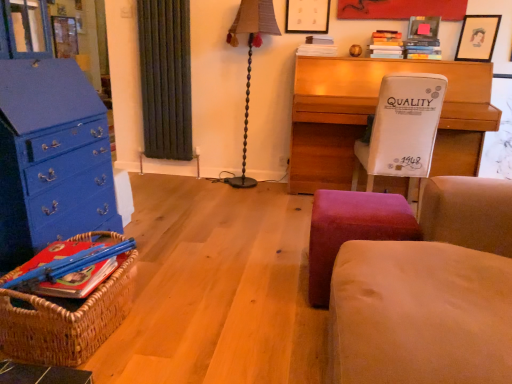
Question: Considering the relative positions of matte black picture frame at upper right, arranged as the second picture frame when viewed from the right, and matte black picture frame at upper right, the first picture frame positioned from the right, in the image provided, is matte black picture frame at upper right, arranged as the second picture frame when viewed from the right, to the right of matte black picture frame at upper right, the first picture frame positioned from the right, from the viewer's perspective?

Choices:
 (A) no
 (B) yes

Answer: (A)

Question: Would you say matte black picture frame at upper right, acting as the 2th picture frame starting from the left, is outside matte black picture frame at upper right, the third picture frame in the left-to-right sequence?

Choices:
 (A) yes
 (B) no

Answer: (A)

Question: Is the depth of matte black picture frame at upper right, arranged as the second picture frame when viewed from the right, less than that of matte black picture frame at upper right, the first picture frame positioned from the right?

Choices:
 (A) yes
 (B) no

Answer: (B)

Question: Is matte black picture frame at upper right, the first picture frame positioned from the right, located within matte black picture frame at upper right, acting as the 2th picture frame starting from the left?

Choices:
 (A) yes
 (B) no

Answer: (B)

Question: Is matte black picture frame at upper right, arranged as the second picture frame when viewed from the right, shorter than matte black picture frame at upper right, the third picture frame in the left-to-right sequence?

Choices:
 (A) yes
 (B) no

Answer: (A)

Question: Is matte black picture frame at upper right, arranged as the second picture frame when viewed from the right, looking in the opposite direction of matte black picture frame at upper right, the first picture frame positioned from the right?

Choices:
 (A) yes
 (B) no

Answer: (B)

Question: Does beige fabric rocking chair at right have a greater height compared to brown fabric lampshade at center?

Choices:
 (A) yes
 (B) no

Answer: (B)

Question: Can you see beige fabric rocking chair at right touching brown fabric lampshade at center?

Choices:
 (A) yes
 (B) no

Answer: (B)

Question: From the image's perspective, does beige fabric rocking chair at right appear higher than brown fabric lampshade at center?

Choices:
 (A) no
 (B) yes

Answer: (A)

Question: From a real-world perspective, is beige fabric rocking chair at right under brown fabric lampshade at center?

Choices:
 (A) yes
 (B) no

Answer: (A)

Question: Would you consider beige fabric rocking chair at right to be distant from brown fabric lampshade at center?

Choices:
 (A) no
 (B) yes

Answer: (B)

Question: Is beige fabric rocking chair at right closer to the viewer compared to brown fabric lampshade at center?

Choices:
 (A) yes
 (B) no

Answer: (A)

Question: From a real-world perspective, does wooden desk at center sit lower than matte black picture frame at upper center, the 3th picture frame from the right?

Choices:
 (A) yes
 (B) no

Answer: (A)